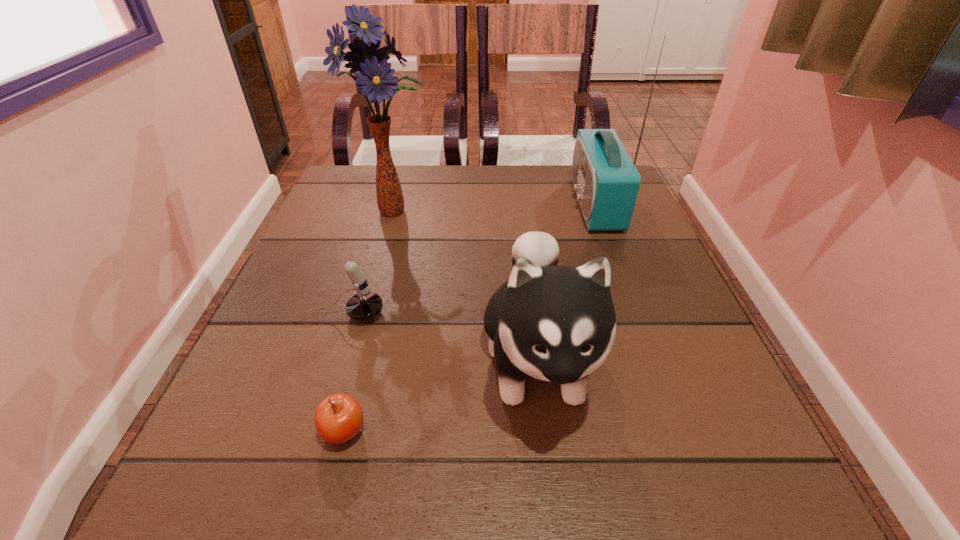
Image resolution: width=960 pixels, height=540 pixels. In order to click on object at the right edge in this screenshot , I will do `click(606, 181)`.

You are a GUI agent. You are given a task and a screenshot of the screen. Output one action in this format:
    pyautogui.click(x=<x>, y=<y>)
    Task: Click on the object that is at the far left corner
    
    Given the screenshot: What is the action you would take?
    pyautogui.click(x=374, y=76)

At what (x,y) coordinates should I click in order to perform the action: click on object that is positioned at the near left corner. Please return your answer as a coordinate pair (x, y). The height and width of the screenshot is (540, 960). Looking at the image, I should click on (338, 418).

The height and width of the screenshot is (540, 960). I want to click on object that is at the far right corner, so click(606, 181).

Image resolution: width=960 pixels, height=540 pixels. In order to click on vacant space at the far edge in this screenshot , I will do `click(530, 180)`.

This screenshot has height=540, width=960. In order to click on vacant space at the near edge of the desktop in this screenshot , I will do `click(477, 513)`.

The image size is (960, 540). Find the location of `free spot at the left edge of the desktop`. free spot at the left edge of the desktop is located at coordinates (308, 285).

The image size is (960, 540). In order to click on free location at the right edge in this screenshot , I will do `click(598, 247)`.

At what (x,y) coordinates should I click in order to perform the action: click on free region at the far left corner of the desktop. Please return your answer as a coordinate pair (x, y). This screenshot has height=540, width=960. Looking at the image, I should click on click(353, 211).

What are the coordinates of `vacant position at the near left corner of the desktop` in the screenshot? It's located at (194, 502).